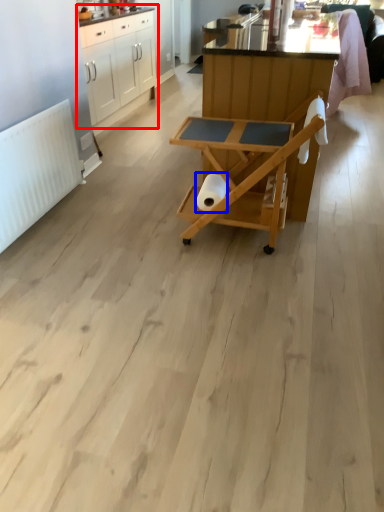
Question: Which point is closer to the camera, cabinetry (highlighted by a red box) or toilet paper (highlighted by a blue box)?

Choices:
 (A) cabinetry
 (B) toilet paper

Answer: (B)